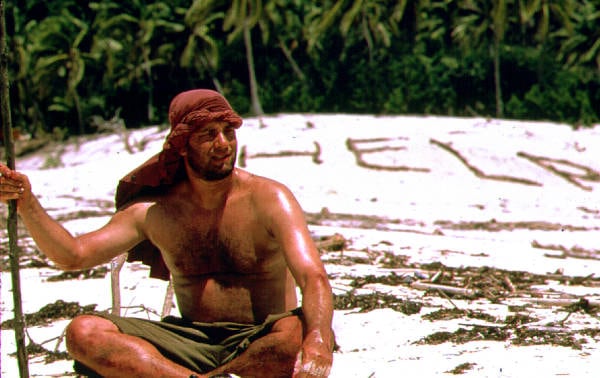
At what (x,y) coordinates should I click in order to perform the action: click on chest. Please return your answer as a coordinate pair (x, y). Image resolution: width=600 pixels, height=378 pixels. Looking at the image, I should click on (241, 247).